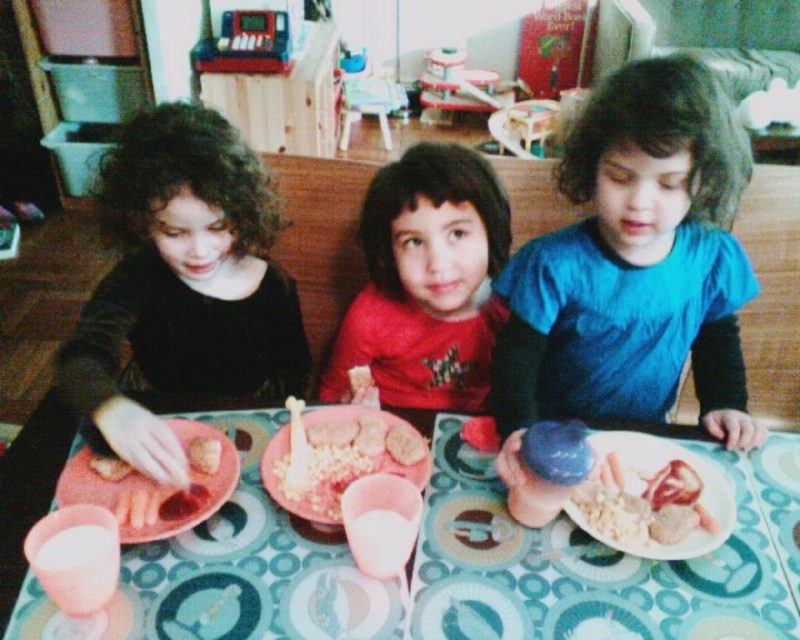
You are a parent trying to hand a pink matte plastic fork at lower left to your child wearing a red matte shirt at center. Can you reach the child without moving the fork?

The red matte shirt at center is further to the viewer than the pink matte plastic fork at lower left, so the parent can reach the child without moving the fork since the child is closer to the parent than the fork is.

You are a parent preparing to serve more food to the children. You have an extra portion of rice and bread. Based on the current arrangement of the yellowish matte rice at center and the smooth white bread at center, which food item is taller and should you consider placing in a taller container?

The yellowish matte rice at center is taller than the smooth white bread at center, so you should consider placing the yellowish matte rice at center in a taller container to accommodate its height.

You are a parent trying to serve more rice to your child. The rice is located at point (340, 458). Where should you look to find the yellowish matte rice at center?

The yellowish matte rice at center is located at point (340, 458).